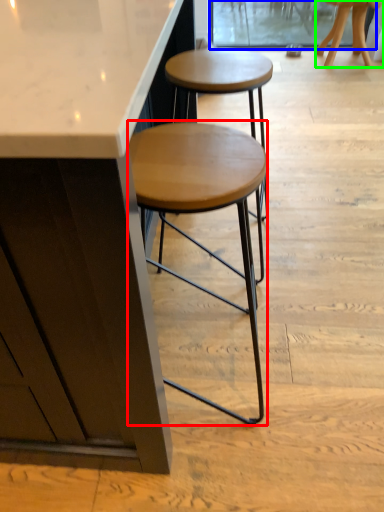
Question: Which object is positioned closest to stool (highlighted by a red box)? Select from screen door (highlighted by a blue box) and stool (highlighted by a green box).

Choices:
 (A) screen door
 (B) stool

Answer: (B)